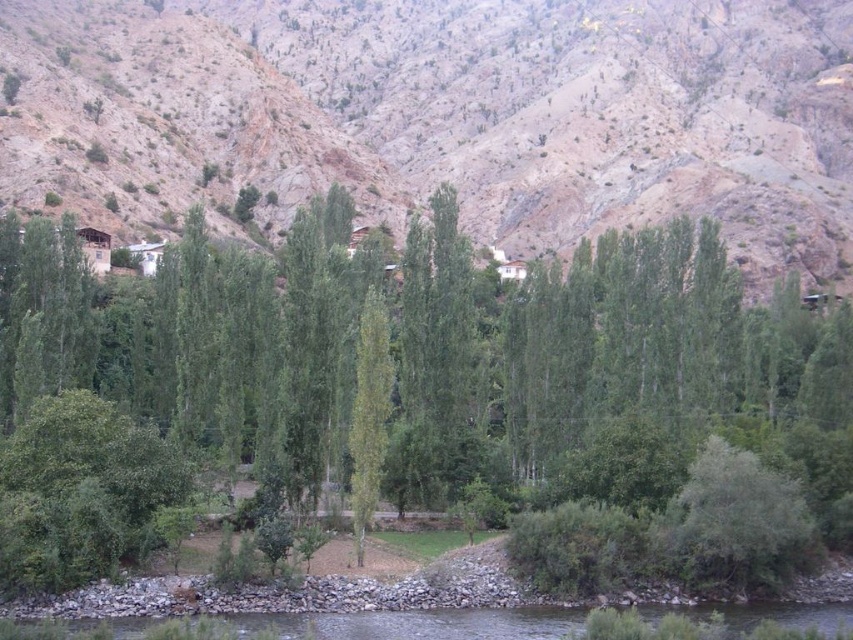
Is dull brown rock at upper center wider than green leafy tree at center?

Yes, dull brown rock at upper center is wider than green leafy tree at center.

Measure the distance between point (462, 168) and camera.

A distance of 755.24 feet exists between point (462, 168) and camera.

Is point (44, 115) more distant than point (685, 307)?

Yes, point (44, 115) is behind point (685, 307).

Image resolution: width=853 pixels, height=640 pixels. I want to click on dull brown rock at upper center, so click(x=451, y=113).

Based on the photo, is green leafy tree at center bigger than clear water at lower center?

Indeed, green leafy tree at center has a larger size compared to clear water at lower center.

Is green leafy tree at center thinner than clear water at lower center?

No.

Does point (471, 390) come farther from viewer compared to point (779, 608)?

Yes, it is behind point (779, 608).

Locate an element on the screen. The height and width of the screenshot is (640, 853). green leafy tree at center is located at coordinates (430, 356).

Can you confirm if green leafy tree at center is smaller than green smooth tree at center?

Incorrect, green leafy tree at center is not smaller in size than green smooth tree at center.

Identify the location of green leafy tree at center. The height and width of the screenshot is (640, 853). tap(430, 356).

Is point (137, 515) positioned after point (364, 502)?

No, it is not.

Locate an element on the screen. green leafy tree at center is located at coordinates (430, 356).